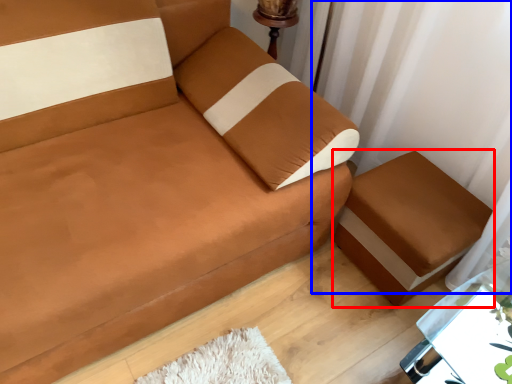
Question: Which object is further to the camera taking this photo, furniture (highlighted by a red box) or curtain (highlighted by a blue box)?

Choices:
 (A) furniture
 (B) curtain

Answer: (A)